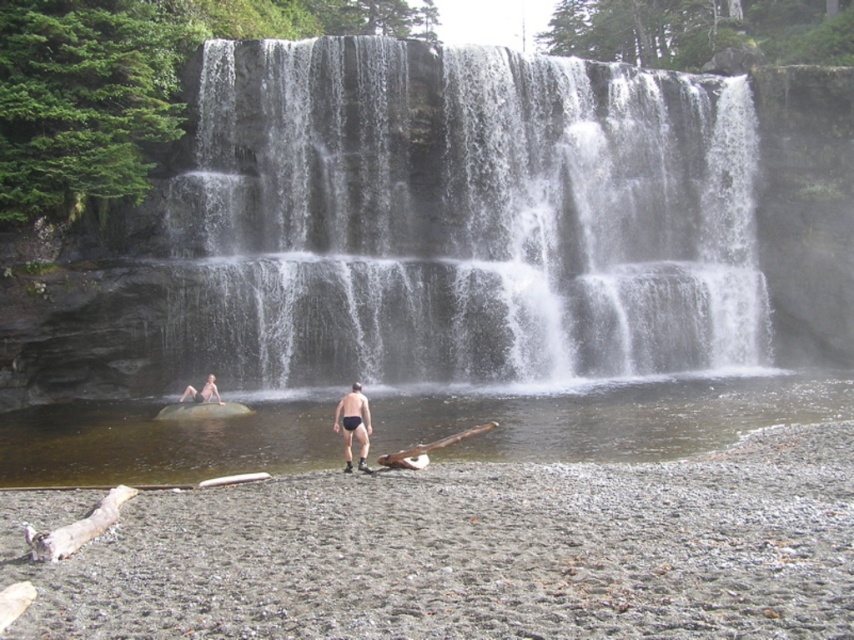
Question: Which point is closer to the camera?

Choices:
 (A) (215, 397)
 (B) (358, 387)

Answer: (A)

Question: Which point appears closest to the camera in this image?

Choices:
 (A) (320, 150)
 (B) (212, 385)

Answer: (B)

Question: Which object appears farthest from the camera in this image?

Choices:
 (A) clear water at lower center
 (B) smooth skin person at lower left
 (C) nude matte swim trunks at center
 (D) brown wood log at center

Answer: (B)

Question: In this image, where is white textured water at center located relative to nude matte swim trunks at center?

Choices:
 (A) right
 (B) left

Answer: (A)

Question: From the image, what is the correct spatial relationship of brown wood log at center in relation to smooth skin person at lower left?

Choices:
 (A) above
 (B) below

Answer: (B)

Question: Is the position of white textured water at center less distant than that of brown wood log at center?

Choices:
 (A) yes
 (B) no

Answer: (B)